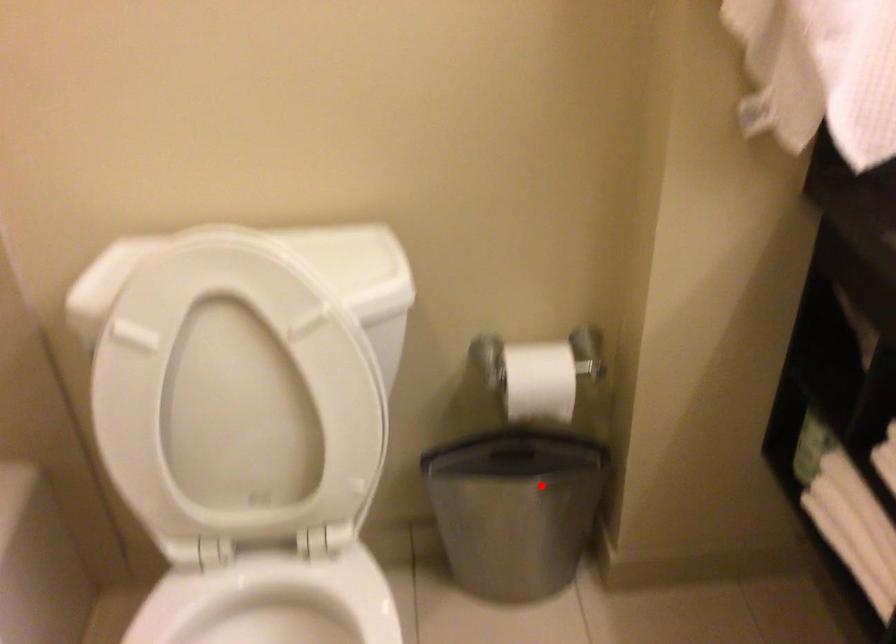
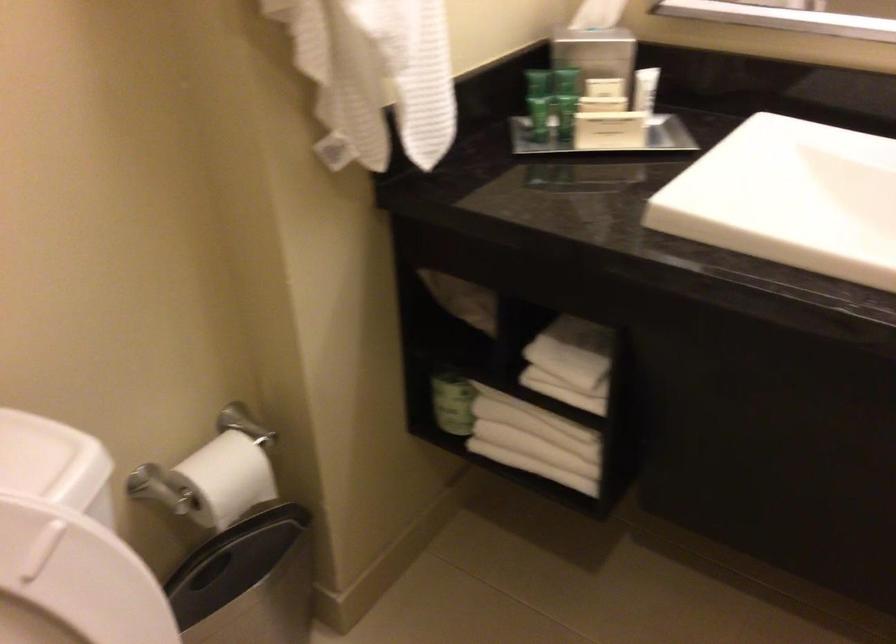
In the second image, find the point that corresponds to the highlighted location in the first image.

(247, 582)